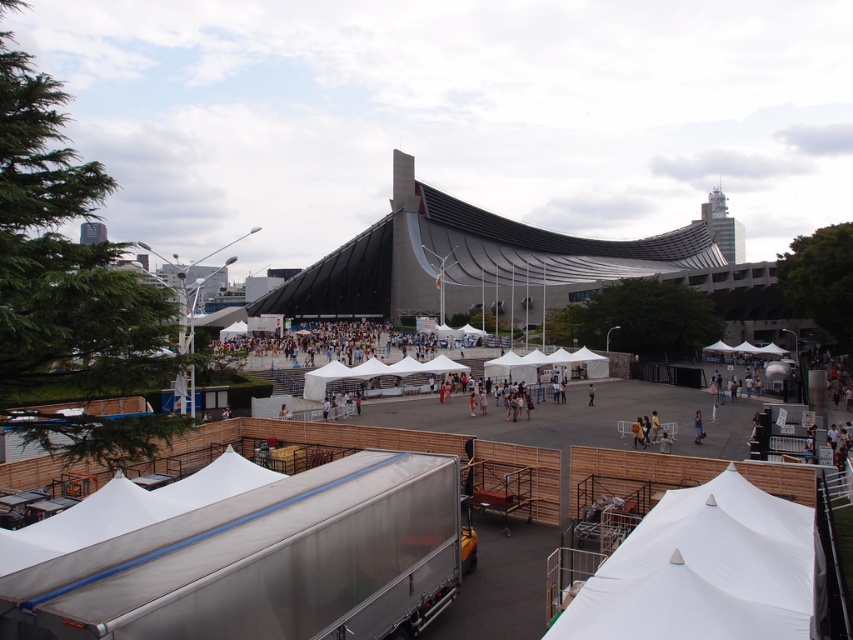
You are an event organizer who needs to place a new booth in the area. Considering the white fabric tent at center and the orange fabric bag at center, which object is bigger and can accommodate more items?

The white fabric tent at center is larger in size compared to the orange fabric bag at center, so it can accommodate more items.

You are a photographer standing at the edge of the event area. You want to take a photo of the light blue fabric shirt at center without the white fabric tent at lower right blocking the view. Is it possible?

The white fabric tent at lower right is taller than the light blue fabric shirt at center, so the tent may block the view of the shirt depending on the angle and distance. To avoid obstruction, position yourself where the shirt is lower in the frame or move closer to reduce the tent height in the shot.